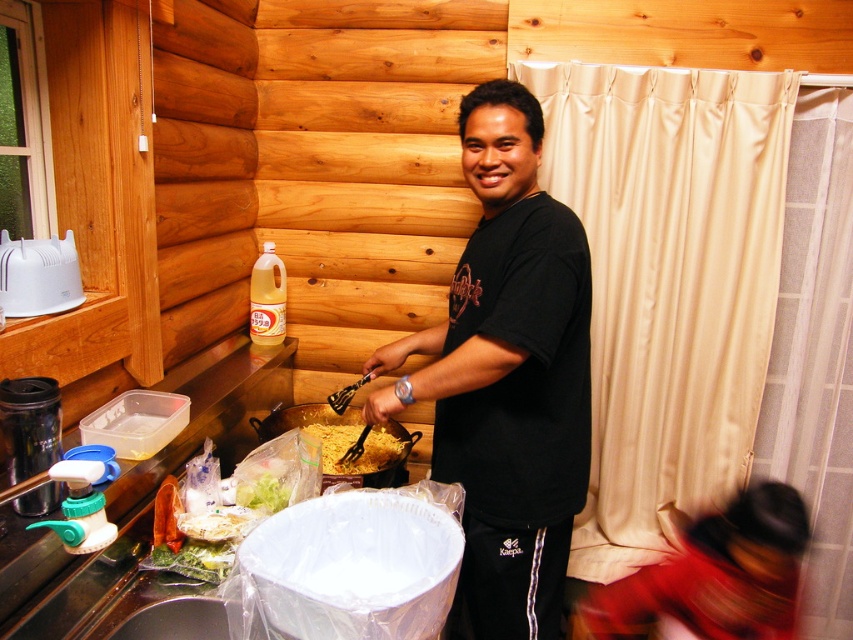
Question: Which object is the closest to the black matte shirt at center?

Choices:
 (A) smooth black shirt at center
 (B) yellow matte noodles at center

Answer: (B)

Question: Based on their relative distances, which object is farther from the smooth black shirt at center?

Choices:
 (A) yellow matte noodles at center
 (B) black matte shirt at center

Answer: (A)

Question: Does smooth black shirt at center have a smaller size compared to yellow matte noodles at center?

Choices:
 (A) yes
 (B) no

Answer: (B)

Question: Among these points, which one is nearest to the camera?

Choices:
 (A) (328, 468)
 (B) (453, 467)

Answer: (B)

Question: Does smooth black shirt at center have a smaller size compared to yellow matte noodles at center?

Choices:
 (A) no
 (B) yes

Answer: (A)

Question: Does black matte shirt at center appear on the right side of yellow matte noodles at center?

Choices:
 (A) no
 (B) yes

Answer: (B)